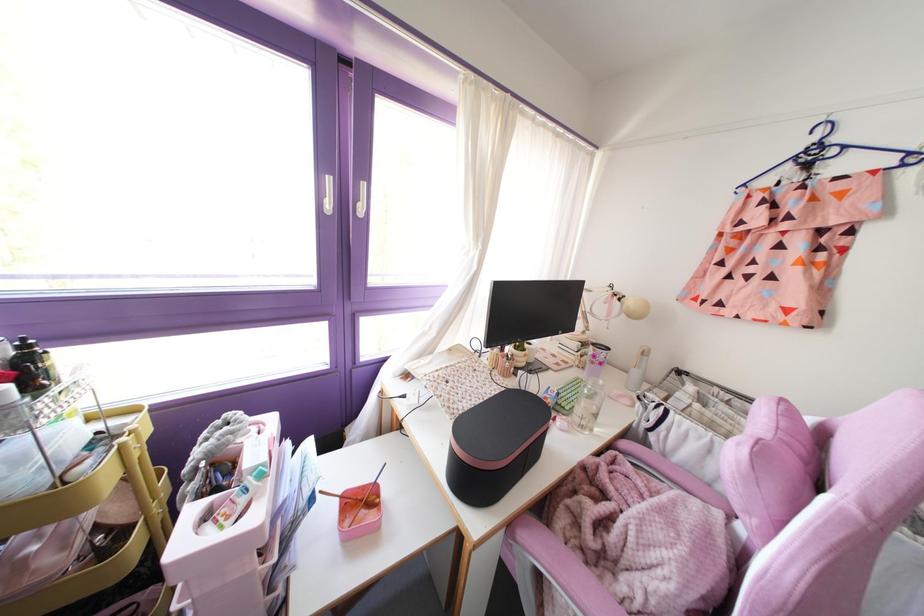
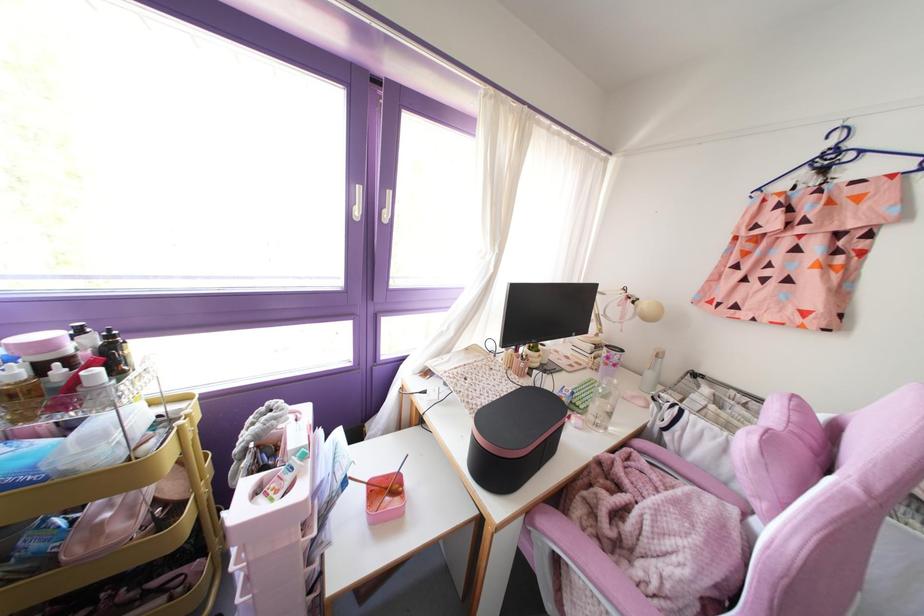
In the second image, find the point that corresponds to pixel 601 382 in the first image.

(614, 381)